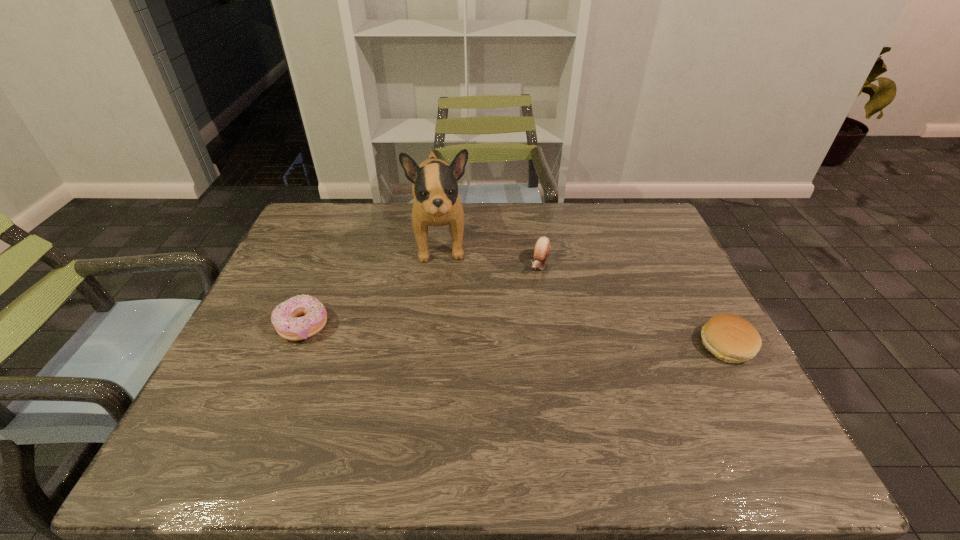
This screenshot has height=540, width=960. In the image, there is a desktop. Identify the location of vacant space at the far right corner. (634, 244).

Locate an element on the screen. vacant space that's between the leftmost object and the puppy is located at coordinates (372, 282).

Locate an element on the screen. free space that is in between the puppy and the second object from right to left is located at coordinates (491, 252).

This screenshot has width=960, height=540. Find the location of `free spot between the leftmost object and the puppy`. free spot between the leftmost object and the puppy is located at coordinates (372, 282).

Where is `vacant area that lies between the tallest object and the leftmost object`? Image resolution: width=960 pixels, height=540 pixels. vacant area that lies between the tallest object and the leftmost object is located at coordinates (372, 282).

I want to click on vacant space in between the escargot and the leftmost object, so click(x=421, y=295).

Identify the location of vacant space in between the rightmost object and the second object from left to right. This screenshot has width=960, height=540. (584, 292).

You are a GUI agent. You are given a task and a screenshot of the screen. Output one action in this format:
    pyautogui.click(x=<x>, y=<y>)
    Task: Click on the blank region between the patty and the doughnut
    
    Given the screenshot: What is the action you would take?
    pyautogui.click(x=515, y=335)

The height and width of the screenshot is (540, 960). Identify the location of vacant point located between the third shortest object and the patty. (633, 305).

The width and height of the screenshot is (960, 540). What are the coordinates of `free space between the third shortest object and the doughnut` in the screenshot? It's located at (421, 295).